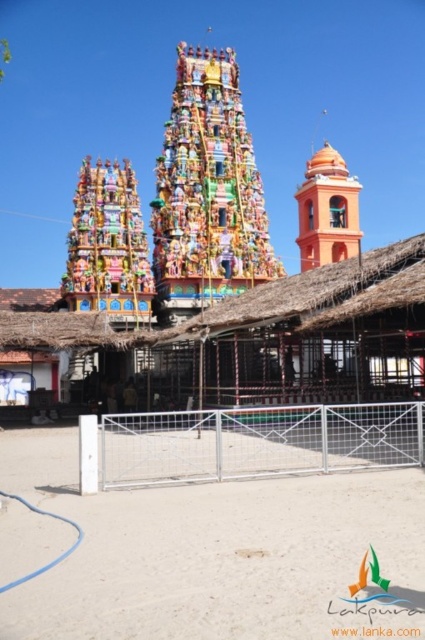
Measure the distance between white sandy ground at lower center and thatched straw hut at center.

white sandy ground at lower center is 24.15 meters away from thatched straw hut at center.

Is white sandy ground at lower center smaller than thatched straw hut at center?

Indeed, white sandy ground at lower center has a smaller size compared to thatched straw hut at center.

What do you see at coordinates (212, 552) in the screenshot?
I see `white sandy ground at lower center` at bounding box center [212, 552].

What are the coordinates of `white sandy ground at lower center` in the screenshot? It's located at (x=212, y=552).

Between point (226, 580) and point (353, 177), which one is positioned in front?

Positioned in front is point (226, 580).

Between white sandy ground at lower center and orange matte bell tower at upper right, which one has less height?

Standing shorter between the two is white sandy ground at lower center.

Is point (115, 634) less distant than point (357, 253)?

That is True.

Identify the location of white sandy ground at lower center. (212, 552).

Which is below, thatched straw hut at center or orange matte bell tower at upper right?

thatched straw hut at center is below.

Which of these two, thatched straw hut at center or orange matte bell tower at upper right, stands taller?

With more height is orange matte bell tower at upper right.

The width and height of the screenshot is (425, 640). I want to click on thatched straw hut at center, so click(x=314, y=332).